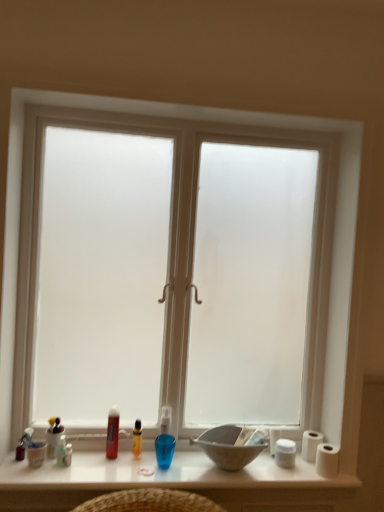
In order to click on vacant area that is in front of translucent plastic bottle at lower left, which appears as the third toiletry when viewed from the right in this screenshot , I will do `click(56, 475)`.